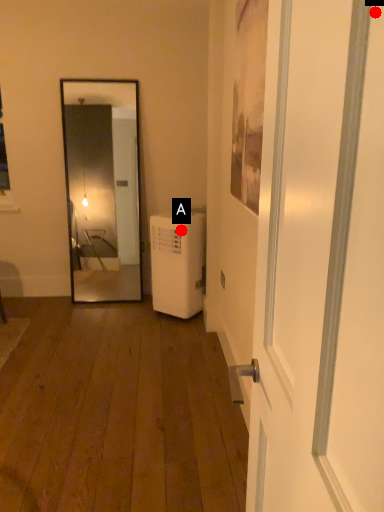
Question: Two points are circled on the image, labeled by A and B beside each circle. Which of the following is the closest to the observer?

Choices:
 (A) A is closer
 (B) B is closer

Answer: (B)